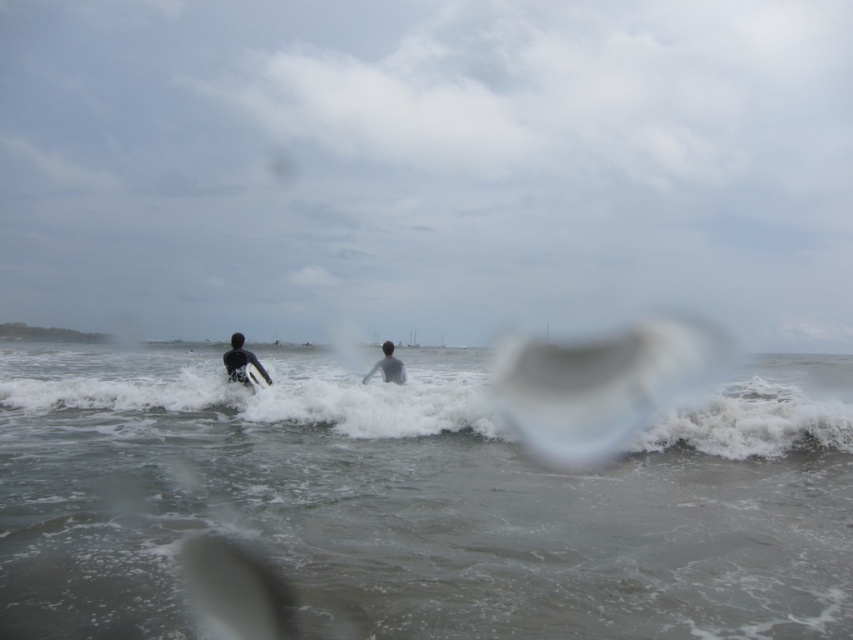
You are a photographer standing on the beach and want to take a photo of both surfers wearing dark gray wetsuits. Which surfer, the dark gray wetsuit at left or the dark gray wetsuit at center, will appear larger in your photo?

The dark gray wetsuit at left will appear larger in the photo because it is closer to the viewer than the dark gray wetsuit at center.

You are a photographer trying to capture a photo of both the dark gray wetsuit at left and the white foam surfboard at center. You want to ensure both subjects are fully visible in the frame. Considering their sizes, which subject should you focus on to avoid cropping either of them?

The dark gray wetsuit at left is larger in width than the white foam surfboard at center, so you should focus on the dark gray wetsuit at left to ensure both subjects fit without cropping.

You are a photographer trying to capture a clear shot of the dark gray wetsuit at left and the white foam surfboard at center. Which object will appear closer to the camera in the photo?

The dark gray wetsuit at left will appear closer to the camera because the white foam surfboard at center is positioned behind it.